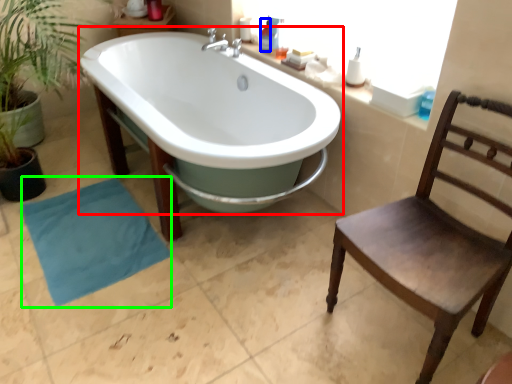
Question: Which is farther away from bathtub (highlighted by a red box)? toiletry (highlighted by a blue box) or beach towel (highlighted by a green box)?

Choices:
 (A) toiletry
 (B) beach towel

Answer: (B)